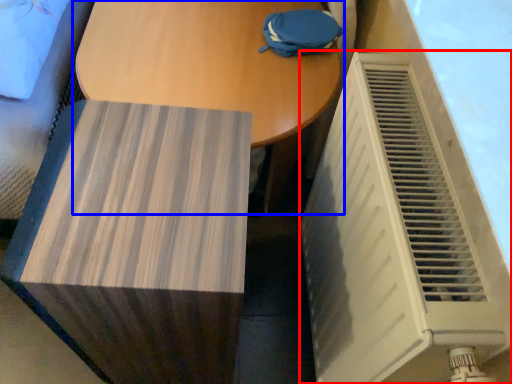
Question: Which object appears closest to the camera in this image, air conditioning (highlighted by a red box) or table (highlighted by a blue box)?

Choices:
 (A) air conditioning
 (B) table

Answer: (A)